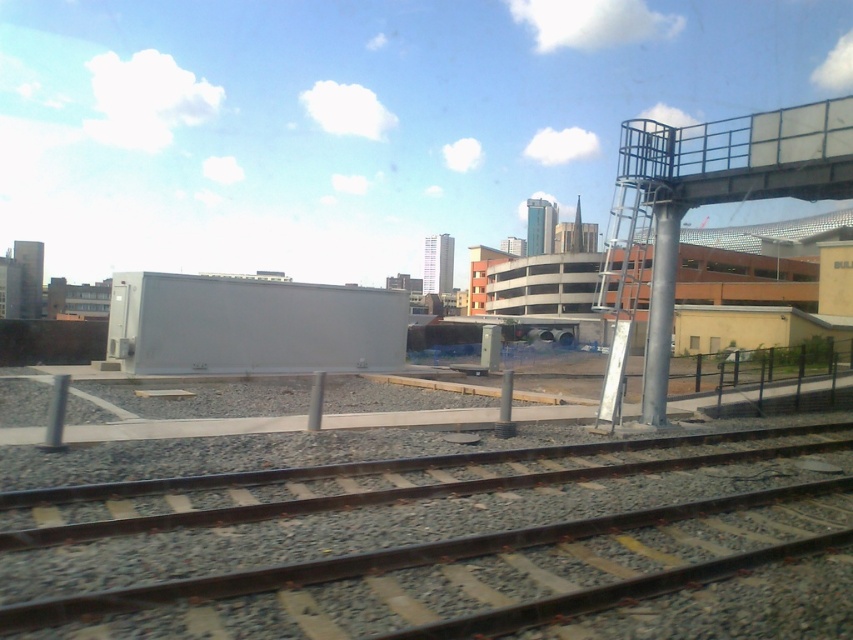
Question: Is rusty metal train track at lower center closer to camera compared to metallic blue railing at upper right?

Choices:
 (A) yes
 (B) no

Answer: (A)

Question: Which object appears closest to the camera in this image?

Choices:
 (A) rusty metal train track at lower center
 (B) metallic blue railing at upper right

Answer: (A)

Question: Can you confirm if rusty metal train track at lower center is smaller than metallic blue railing at upper right?

Choices:
 (A) no
 (B) yes

Answer: (B)

Question: Is rusty metal train track at lower center below metallic blue railing at upper right?

Choices:
 (A) yes
 (B) no

Answer: (A)

Question: Among these points, which one is farthest from the camera?

Choices:
 (A) (741, 120)
 (B) (561, 566)

Answer: (A)